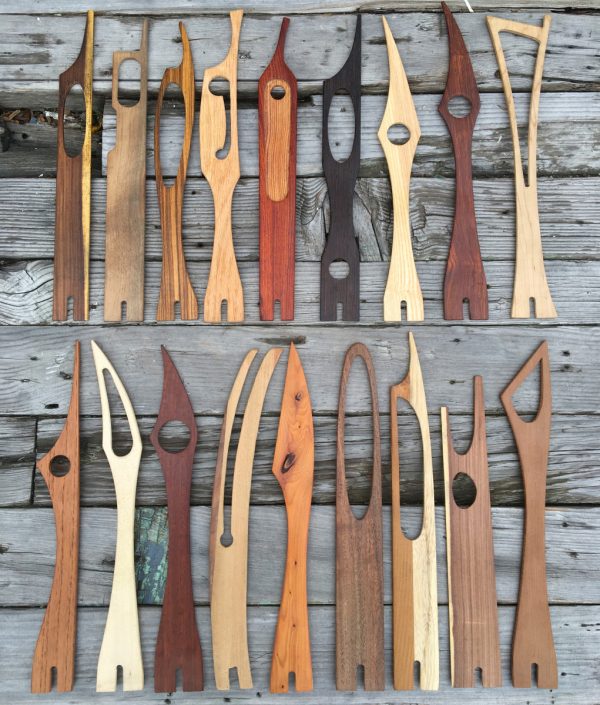
Identify the location of wood table. The image size is (600, 705). (24, 221).